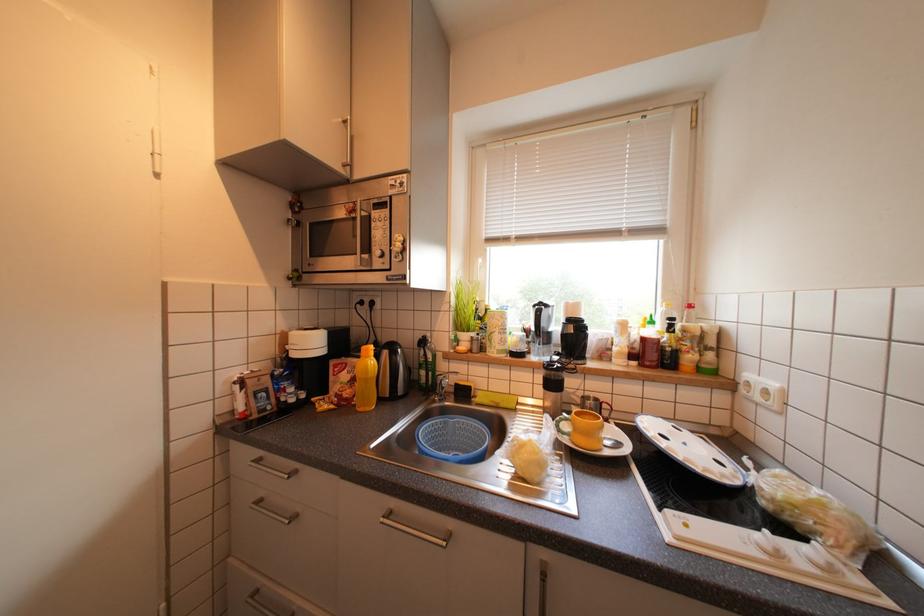
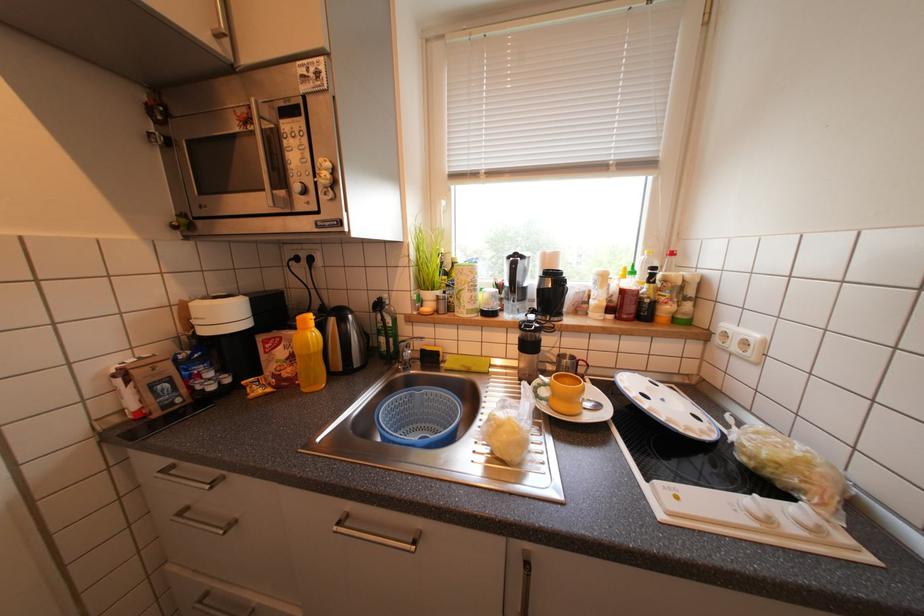
Question: Based on the continuous images, in which direction is the camera rotating? Reply with the corresponding letter.

Choices:
 (A) Left
 (B) Right
 (C) Up
 (D) Down

Answer: (D)